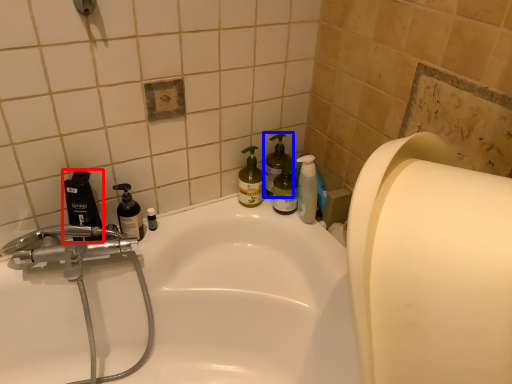
Question: Which point is further to the camera, mouthwash (highlighted by a red box) or cleaning product (highlighted by a blue box)?

Choices:
 (A) mouthwash
 (B) cleaning product

Answer: (B)